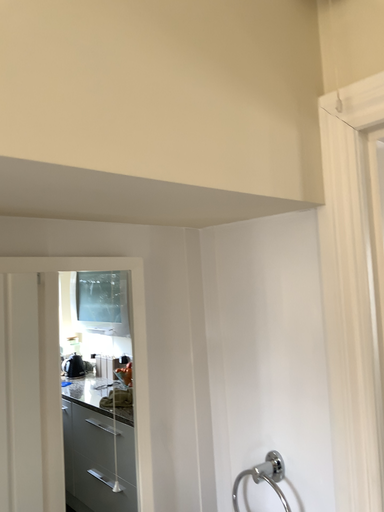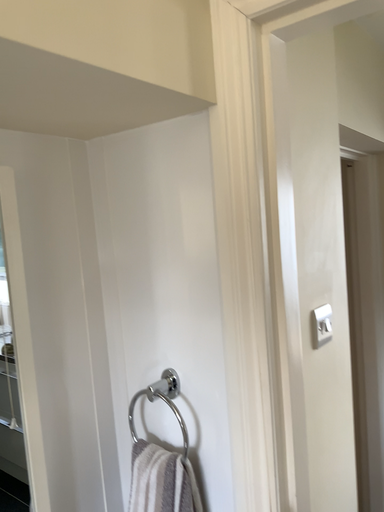
Question: How did the camera likely rotate when shooting the video?

Choices:
 (A) rotated upward
 (B) rotated downward

Answer: (B)